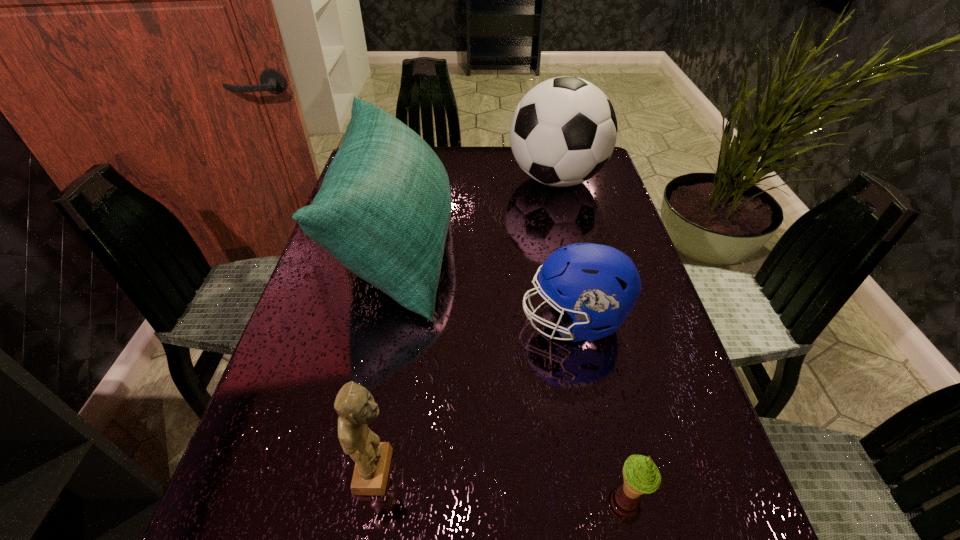
Find the location of a particular element. object that stands as the third closest to the icecream is located at coordinates (383, 210).

Where is `free spot that satisfies the following two spatial constraints: 1. on the front side of the soccer ball; 2. on the front-facing side of the figurine`? The height and width of the screenshot is (540, 960). free spot that satisfies the following two spatial constraints: 1. on the front side of the soccer ball; 2. on the front-facing side of the figurine is located at coordinates (624, 471).

This screenshot has width=960, height=540. In order to click on vacant area that satisfies the following two spatial constraints: 1. on the front-facing side of the icecream; 2. on the right side of the cushion in this screenshot , I will do `click(347, 490)`.

Image resolution: width=960 pixels, height=540 pixels. I want to click on free point that satisfies the following two spatial constraints: 1. on the back side of the shortest object; 2. on the front-facing side of the figurine, so click(x=628, y=471).

Image resolution: width=960 pixels, height=540 pixels. What are the coordinates of `vacant area in the image that satisfies the following two spatial constraints: 1. on the front-facing side of the figurine; 2. on the left side of the shortest object` in the screenshot? It's located at (373, 490).

Identify the location of free location that satisfies the following two spatial constraints: 1. on the front side of the soccer ball; 2. on the front-facing side of the figurine. The width and height of the screenshot is (960, 540). (624, 471).